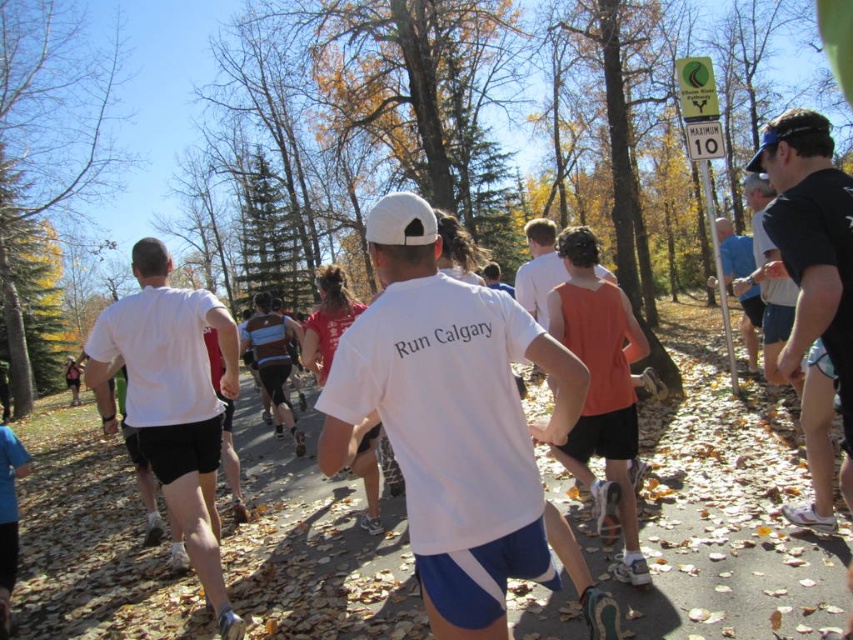
You are a photographer positioned at the point with coordinates (173, 401) in the image. What object is directly in front of you?

The point at coordinates (173, 401) corresponds to the white matte shorts at center, so the object directly in front of you is the white matte shorts at center.

In the scene shown: You are a photographer at the autumn running event. You want to capture a photo that includes both the orange cotton tank top at center and the blue fabric shirt at right. Which object should you focus on first if you want to ensure both are in the frame without moving the camera?

You should focus on the orange cotton tank top at center first because it occupies less space than the blue fabric shirt at right, so centering it first allows the larger blue fabric shirt at right to fit into the frame more easily.

You are a photographer positioned at the starting line of the race. You want to capture a photo that includes both the white matte shorts at center and the black mesh shorts at right. Which runner should you focus on first to ensure both are in the frame?

The white matte shorts at center is taller than the black mesh shorts at right, so you should focus on the white matte shorts at center first to ensure both are in the frame.